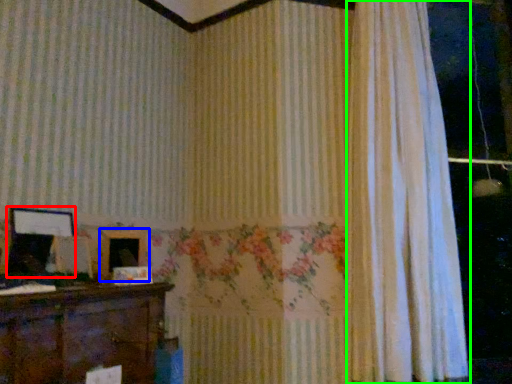
Question: Estimate the real-world distances between objects in this image. Which object is farther from picture frame (highlighted by a red box), picture frame (highlighted by a blue box) or curtain (highlighted by a green box)?

Choices:
 (A) picture frame
 (B) curtain

Answer: (B)